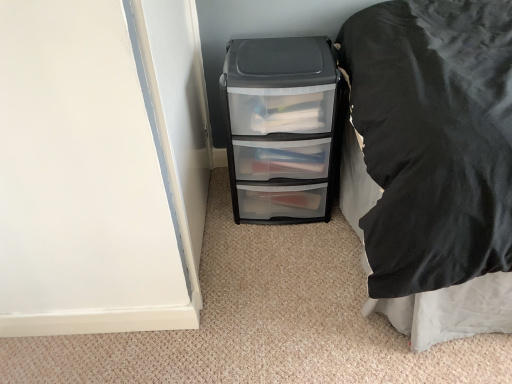
Question: From the image's perspective, is clear plastic drawer unit at lower right above or below transparent plastic file cabinet at center?

Choices:
 (A) below
 (B) above

Answer: (A)

Question: Considering the positions of point (408, 256) and point (272, 115), is point (408, 256) closer or farther from the camera than point (272, 115)?

Choices:
 (A) farther
 (B) closer

Answer: (B)

Question: Is clear plastic drawer unit at lower right bigger or smaller than transparent plastic file cabinet at center?

Choices:
 (A) big
 (B) small

Answer: (A)

Question: Is transparent plastic file cabinet at center bigger or smaller than clear plastic drawer unit at lower right?

Choices:
 (A) small
 (B) big

Answer: (A)

Question: From a real-world perspective, relative to clear plastic drawer unit at lower right, is transparent plastic file cabinet at center vertically above or below?

Choices:
 (A) above
 (B) below

Answer: (B)

Question: Considering the positions of transparent plastic file cabinet at center and clear plastic drawer unit at lower right in the image, is transparent plastic file cabinet at center taller or shorter than clear plastic drawer unit at lower right?

Choices:
 (A) tall
 (B) short

Answer: (B)

Question: Which is correct: transparent plastic file cabinet at center is inside clear plastic drawer unit at lower right, or outside of it?

Choices:
 (A) inside
 (B) outside

Answer: (B)